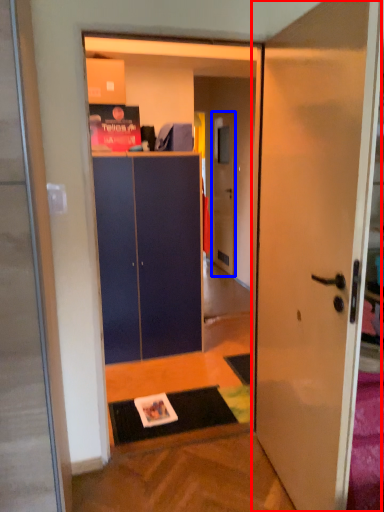
Question: Which object appears closest to the camera in this image, door (highlighted by a red box) or door (highlighted by a blue box)?

Choices:
 (A) door
 (B) door

Answer: (A)